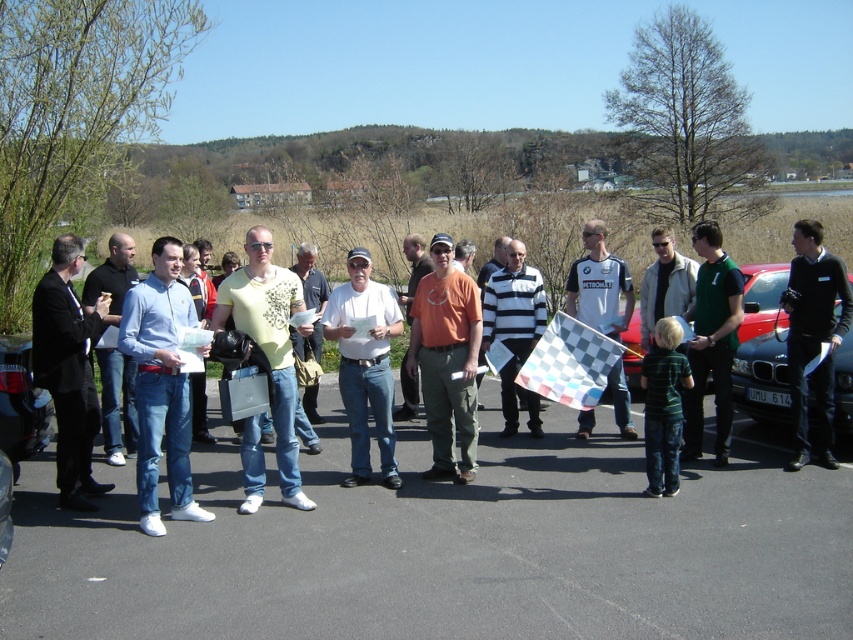
Question: Which object is positioned farthest from the orange cotton t-shirt at center?

Choices:
 (A) white cotton shirt at center
 (B) black metallic car at right
 (C) matte gray shirt at center
 (D) white jersey at center

Answer: (B)

Question: Is green fabric shirt at center above matte yellow t-shirt at center?

Choices:
 (A) no
 (B) yes

Answer: (A)

Question: Is white cotton shirt at center to the left of matte gray shirt at center from the viewer's perspective?

Choices:
 (A) yes
 (B) no

Answer: (A)

Question: Can you confirm if black asphalt parking lot at center is smaller than green fabric shirt at center?

Choices:
 (A) no
 (B) yes

Answer: (B)

Question: Which object is closer to the camera taking this photo?

Choices:
 (A) black suit jacket at left
 (B) orange cotton shirt at center
 (C) striped jersey at center

Answer: (A)

Question: Estimate the real-world distances between objects in this image. Which object is farther from the striped jersey at center?

Choices:
 (A) orange cotton shirt at center
 (B) green fabric shirt at center
 (C) matte gray shirt at center

Answer: (B)